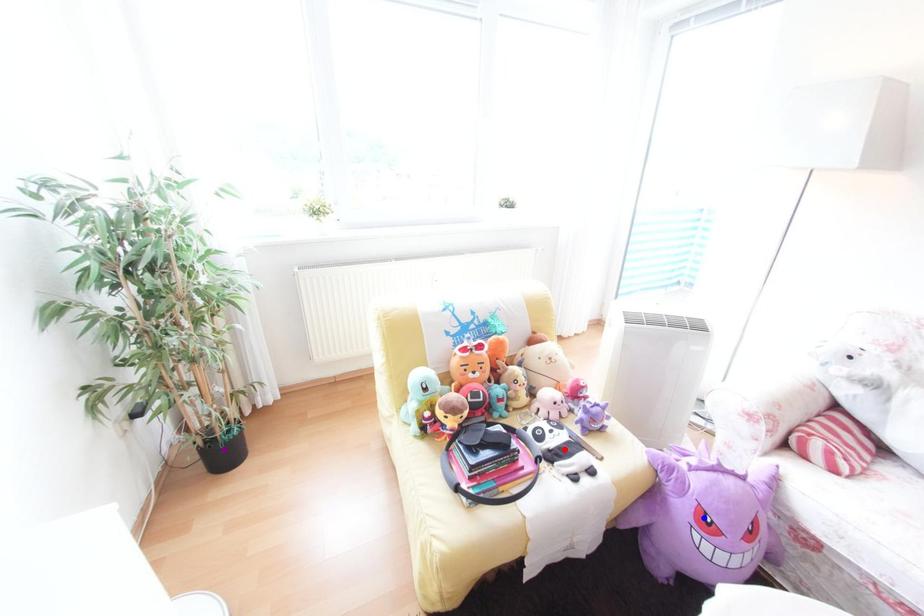
Order these from nearest to farthest:
- purple point
- blue point
- red point

blue point
red point
purple point